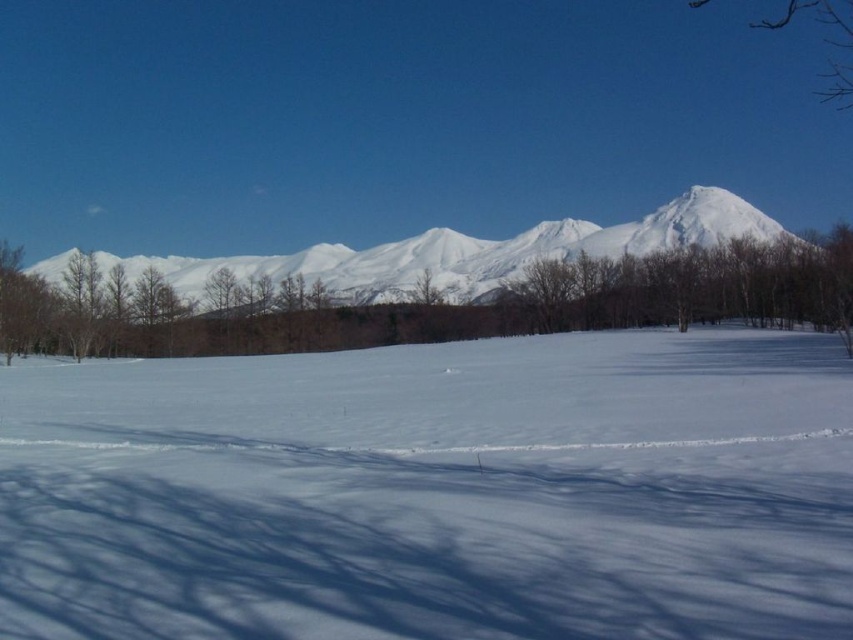
Is white snow at center further to the viewer compared to white snow-covered mountain at center?

No.

Does white snow at center have a smaller size compared to white snow-covered mountain at center?

Yes, white snow at center is smaller than white snow-covered mountain at center.

Who is more forward, (494, 424) or (645, 224)?

Point (494, 424) is in front.

At what (x,y) coordinates should I click in order to perform the action: click on white snow at center. Please return your answer as a coordinate pair (x, y). Looking at the image, I should click on (434, 492).